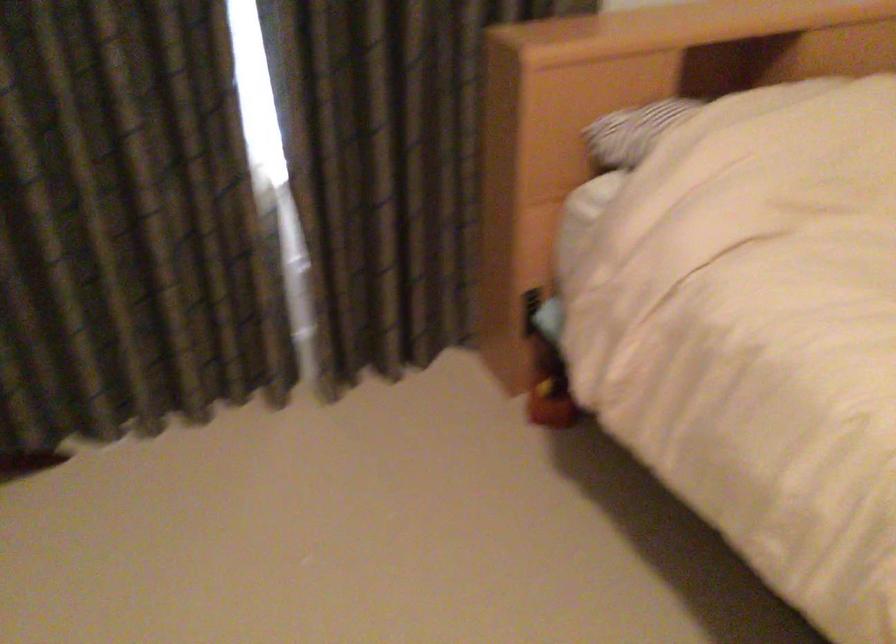
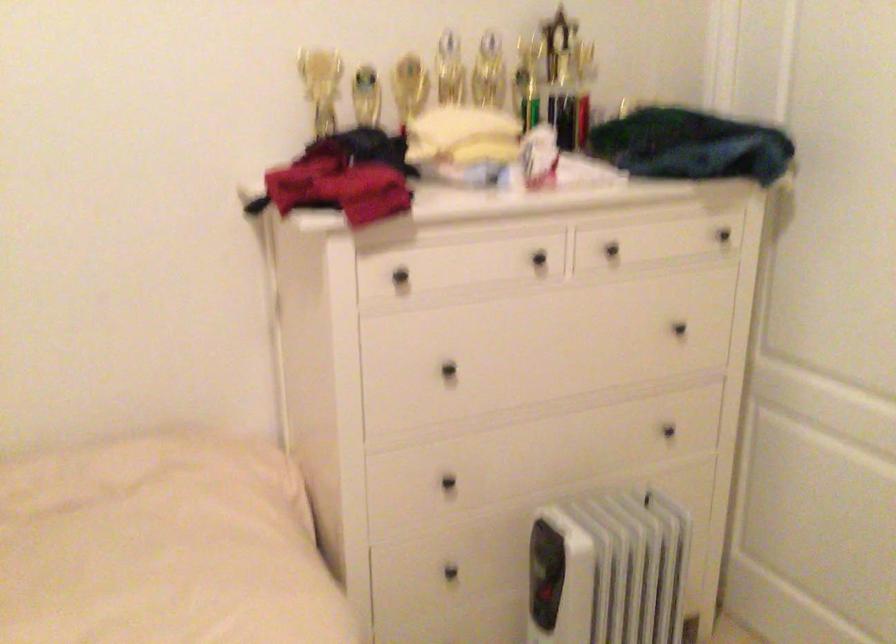
Question: How did the camera likely rotate?

Choices:
 (A) Left
 (B) Right
 (C) Up
 (D) Down

Answer: (B)